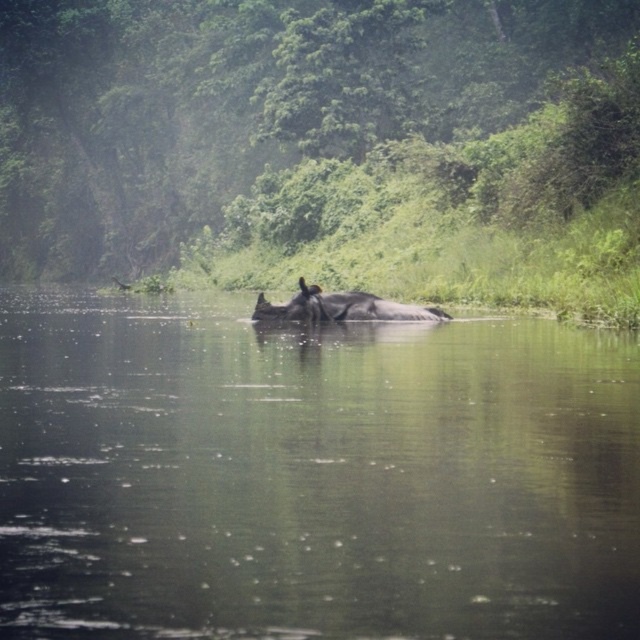
Question: Which of the following is the closest to the observer?

Choices:
 (A) gray matte rhinoceros at center
 (B) green leafy vegetation at center

Answer: (A)

Question: Does greenish murky water at center have a lesser width compared to green leafy vegetation at center?

Choices:
 (A) no
 (B) yes

Answer: (B)

Question: Which is nearer to the gray matte rhinoceros at center?

Choices:
 (A) green leafy vegetation at center
 (B) greenish murky water at center

Answer: (B)

Question: Which point is closer to the camera?

Choices:
 (A) green leafy vegetation at center
 (B) gray matte rhinoceros at center

Answer: (B)

Question: Is green leafy vegetation at center smaller than gray matte rhinoceros at center?

Choices:
 (A) no
 (B) yes

Answer: (A)

Question: Is greenish murky water at center bigger than gray matte rhinoceros at center?

Choices:
 (A) yes
 (B) no

Answer: (A)